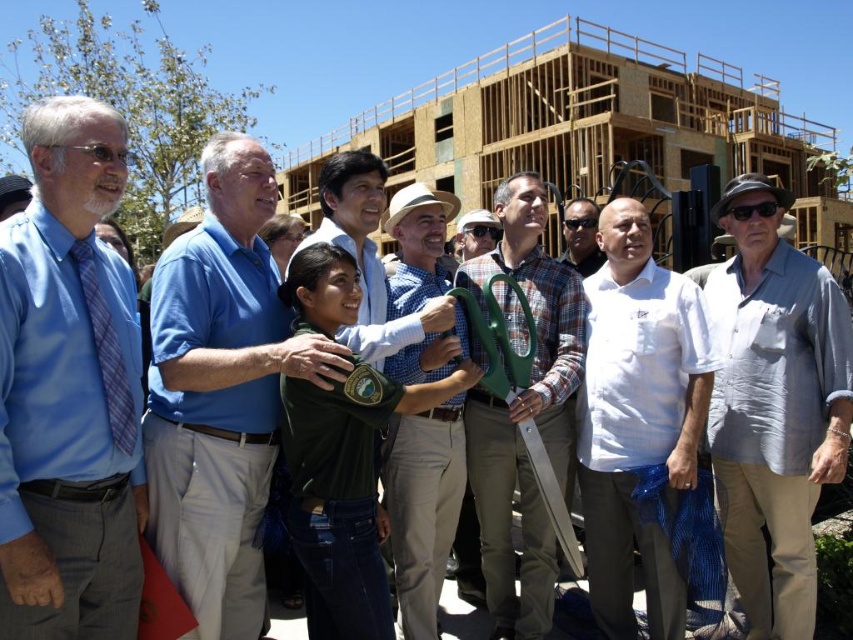
Is point (76, 241) less distant than point (567, 230)?

Yes, it is.

Is point (123, 426) more distant than point (584, 240)?

That is False.

Where is `blue plaid tie at left`? blue plaid tie at left is located at coordinates (106, 349).

Is gray silk shirt at right positioned in front of matte blue shirt at center?

Yes, gray silk shirt at right is in front of matte blue shirt at center.

Is point (723, 460) closer to viewer compared to point (490, 250)?

Yes, it is in front of point (490, 250).

Which is behind, point (805, 406) or point (477, 228)?

Positioned behind is point (477, 228).

At what (x,y) coordinates should I click in order to perform the action: click on gray silk shirt at right. Please return your answer as a coordinate pair (x, y). Looking at the image, I should click on (775, 406).

Can you confirm if blue silk shirt at left is shorter than matte blue shirt at center?

In fact, blue silk shirt at left may be taller than matte blue shirt at center.

Can you confirm if blue silk shirt at left is bigger than matte blue shirt at center?

Yes.

The width and height of the screenshot is (853, 640). Find the location of `blue silk shirt at left`. blue silk shirt at left is located at coordinates (68, 388).